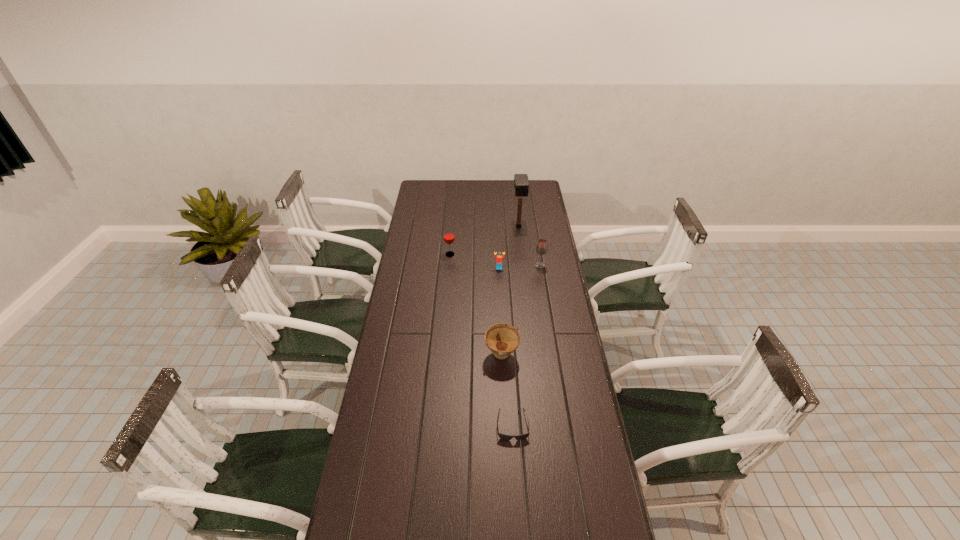
This screenshot has height=540, width=960. Identify the location of vacant space in between the tallest object and the soup bowl. (510, 291).

You are a GUI agent. You are given a task and a screenshot of the screen. Output one action in this format:
    pyautogui.click(x=<x>, y=<y>)
    Task: Click on the free area in between the soup bowl and the Lego
    The width and height of the screenshot is (960, 540).
    Given the screenshot: What is the action you would take?
    pyautogui.click(x=500, y=312)

Locate an element on the screen. The image size is (960, 540). free spot between the Lego and the mallet is located at coordinates (509, 247).

Find the location of a particular element. This screenshot has height=540, width=960. empty space that is in between the shortest object and the fourth tallest object is located at coordinates point(507,390).

In order to click on object that stands as the fourth closest to the fifth nearest object in this screenshot , I will do `click(502, 339)`.

Find the location of `object that is the third closest to the shortest object`. object that is the third closest to the shortest object is located at coordinates (541, 248).